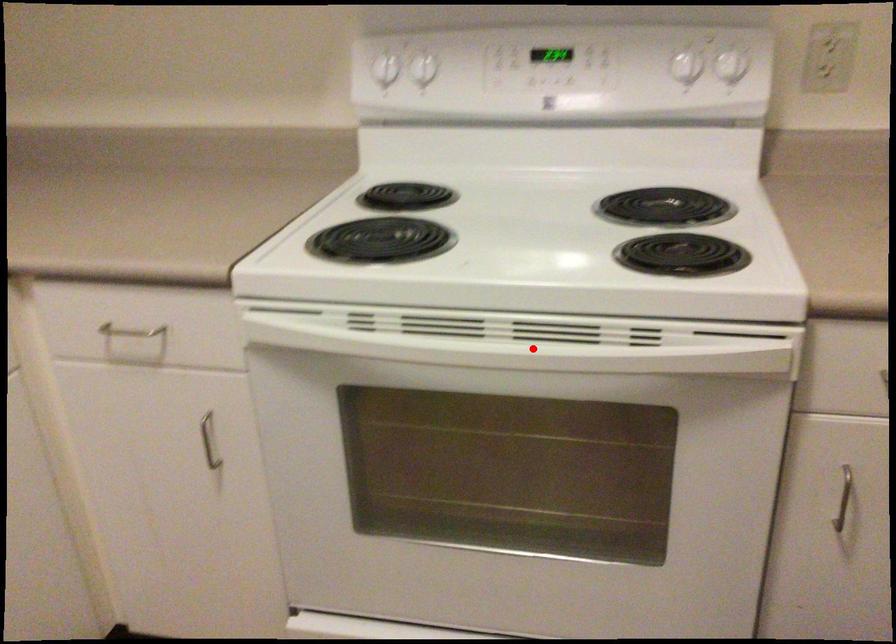
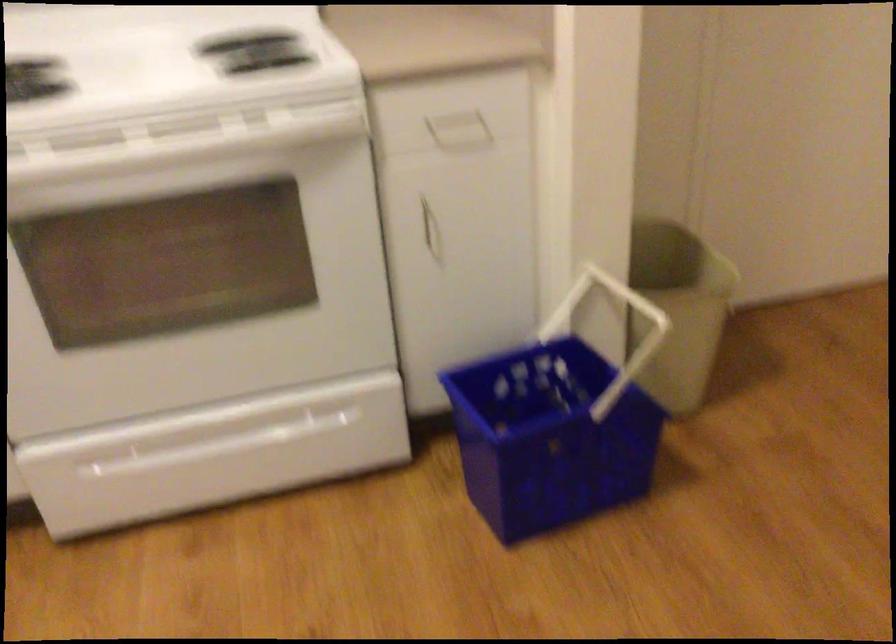
Question: I am providing you with two images of the same scene from different viewpoints. Image1 has a red point marked. In image2, the corresponding 3D location appears at what relative position? Reply with the corresponding letter.

Choices:
 (A) Closer
 (B) Farther

Answer: (B)